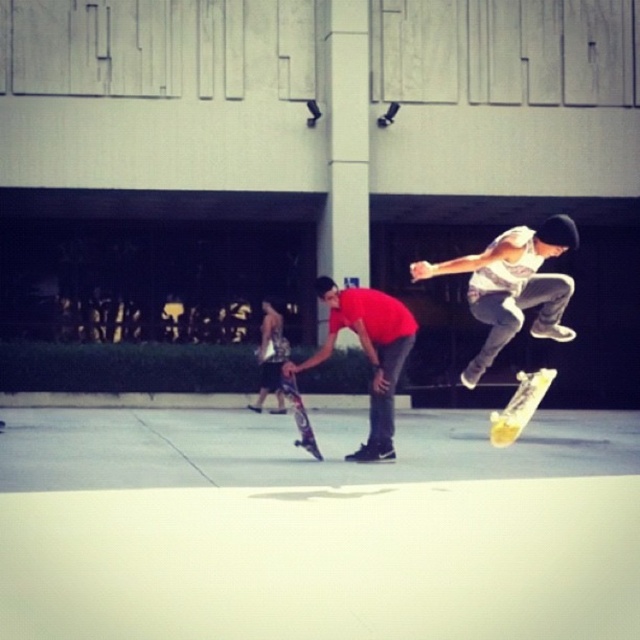
You are a photographer capturing the skateboarding scene. You need to focus on the white cotton tank top at upper right and the yellow wooden skateboard at center. Which object should you zoom in on first if you want to capture the thinner item?

The white cotton tank top at upper right is thinner than the yellow wooden skateboard at center, so you should zoom in on the white cotton tank top at upper right first.

You are a photographer trying to capture a photo of both the matte red shirt at center and the shiny purple skateboard at center. Which one should you focus on first if you want to ensure both are in focus?

The matte red shirt at center is positioned on the right side of shiny purple skateboard at center, so you should focus on the shiny purple skateboard at center first to ensure both are in focus.